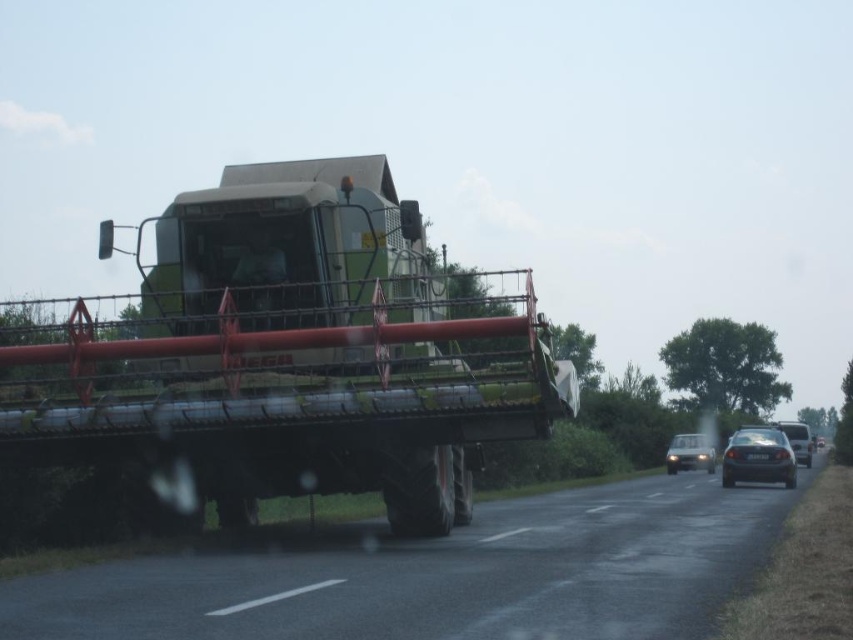
Question: Which object is positioned closest to the shiny black sedan at right?

Choices:
 (A) silver metallic sedan at right
 (B) shiny silver sedan at right

Answer: (A)

Question: Which point is closer to the camera?

Choices:
 (A) silver metallic sedan at right
 (B) black asphalt road at center
 (C) shiny black sedan at right

Answer: (B)

Question: Does green matte trailer truck at center appear under shiny silver sedan at right?

Choices:
 (A) no
 (B) yes

Answer: (A)

Question: Does shiny black sedan at right have a greater width compared to shiny silver sedan at right?

Choices:
 (A) no
 (B) yes

Answer: (A)

Question: Which of the following is the closest to the observer?

Choices:
 (A) coord(805,428)
 (B) coord(692,464)

Answer: (B)

Question: From the image, what is the correct spatial relationship of black asphalt road at center in relation to shiny black sedan at right?

Choices:
 (A) below
 (B) above

Answer: (B)